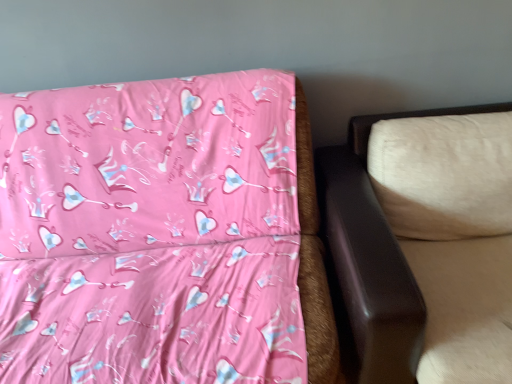
Image resolution: width=512 pixels, height=384 pixels. What do you see at coordinates (162, 235) in the screenshot?
I see `pink fabric bed at left` at bounding box center [162, 235].

Find the location of a particular element. The height and width of the screenshot is (384, 512). pink fabric bed at left is located at coordinates (162, 235).

The image size is (512, 384). In order to click on pink fabric bed at left in this screenshot , I will do `click(162, 235)`.